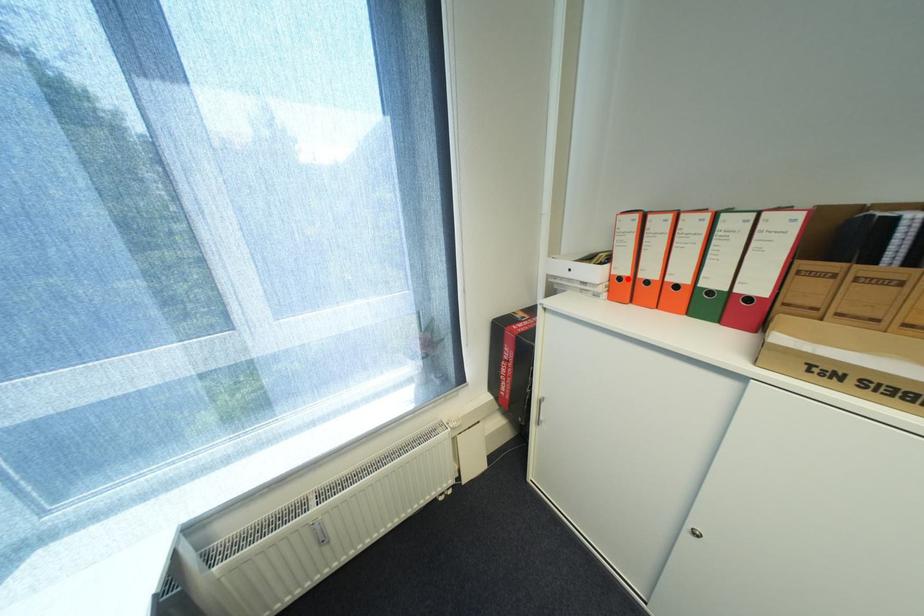
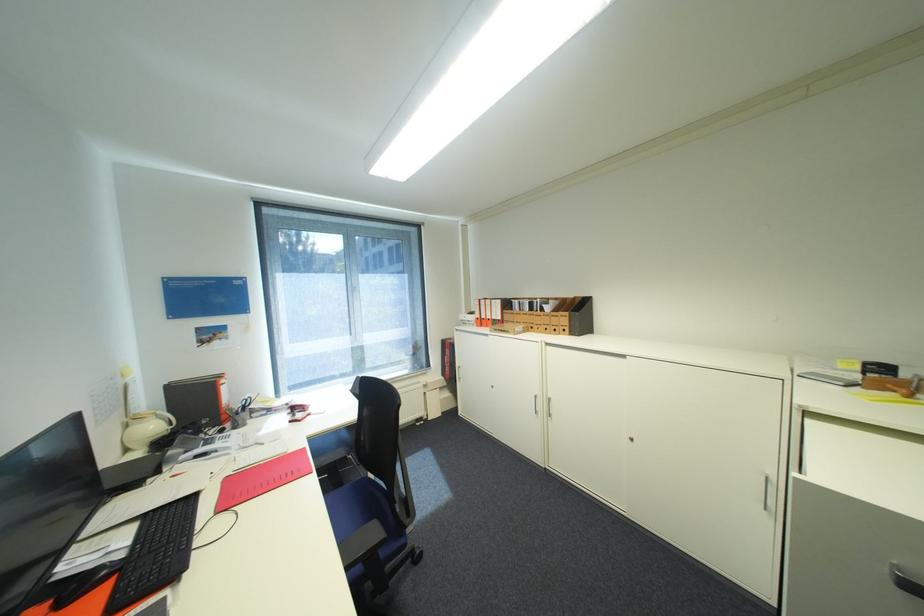
Locate, in the second image, the point that corresponds to the highlighted location in the first image.

(485, 318)